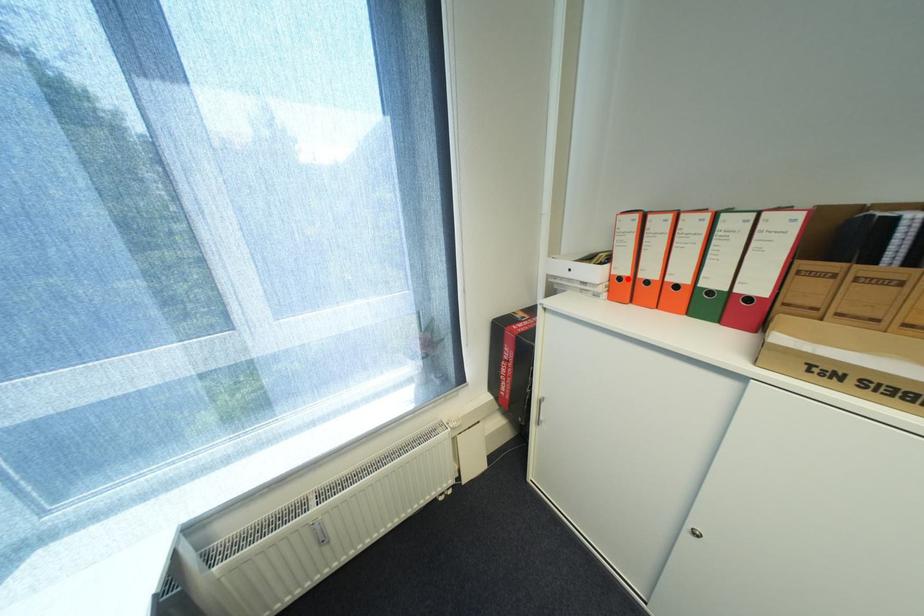
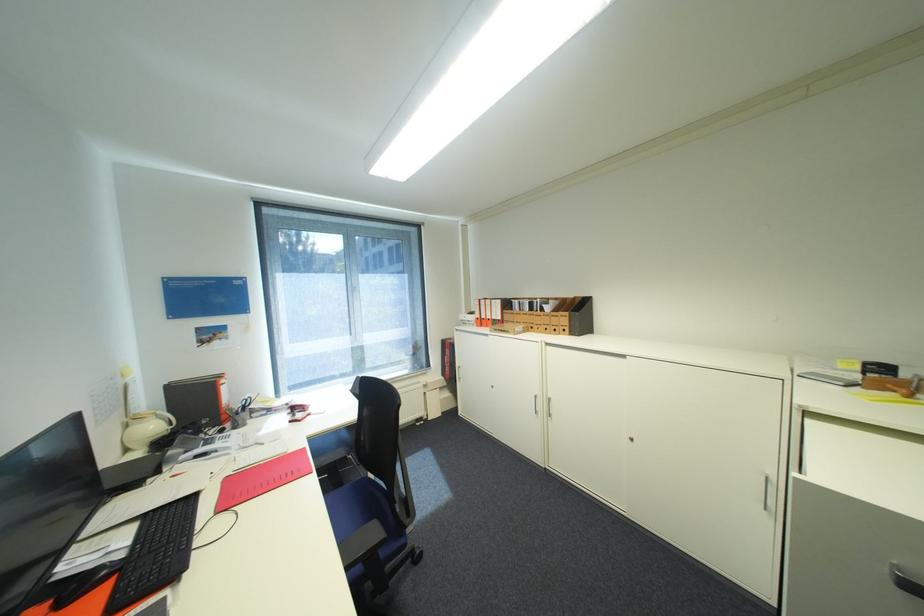
Locate, in the second image, the point that corresponds to the highlighted location in the first image.

(485, 318)